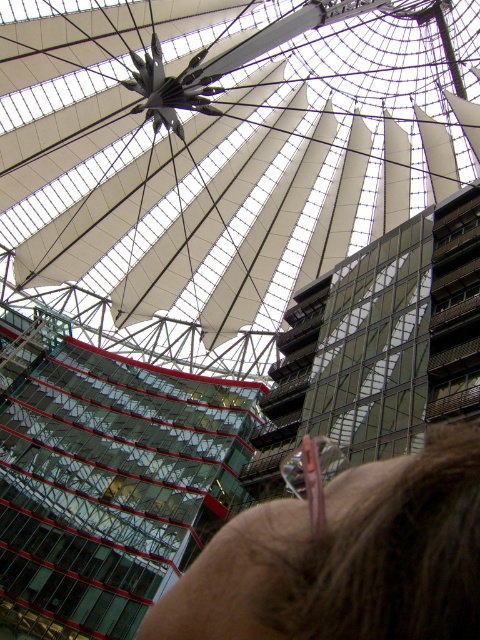
Between white fabric roof at center and brown hair at upper center, which one is positioned lower?

brown hair at upper center

Which is behind, point (271, 180) or point (276, 577)?

Point (271, 180)

Measure the distance between white fabric roof at center and camera.

The distance of white fabric roof at center from camera is 214.02 feet.

Where is `white fabric roof at center`? This screenshot has height=640, width=480. white fabric roof at center is located at coordinates (220, 157).